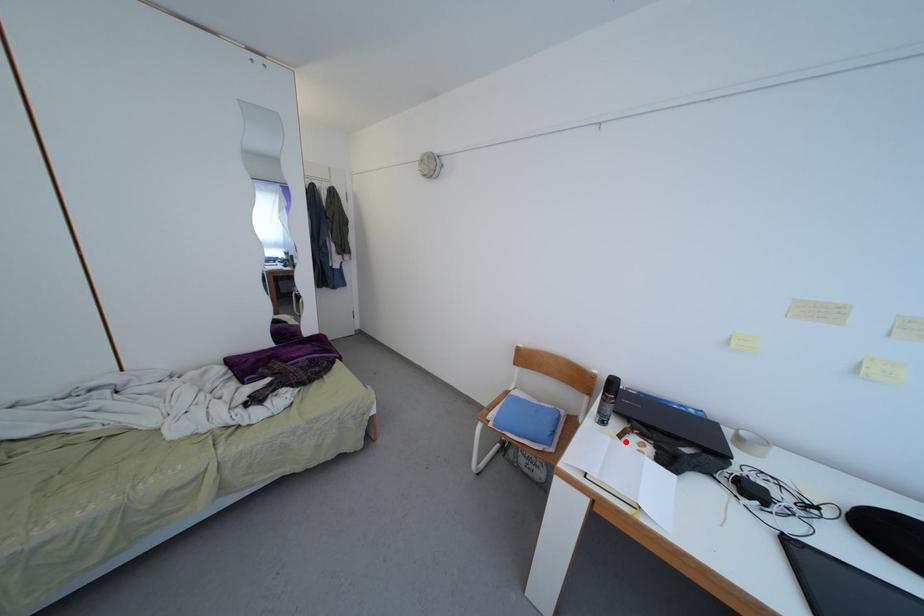
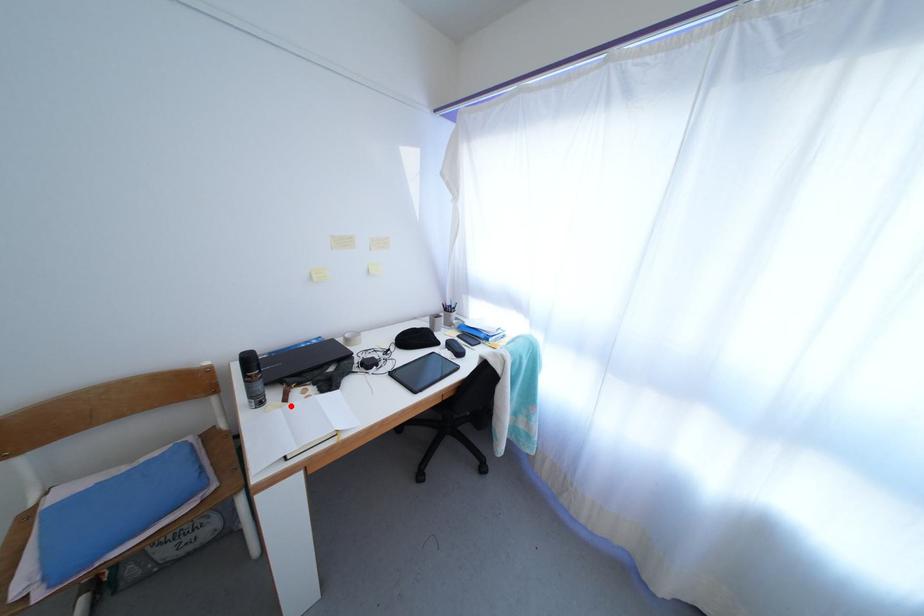
I am providing you with two images of the same scene from different viewpoints. A red point is marked on the first image and another point is marked on the second image. Are the points marked in image1 and image2 representing the same 3D position?

Yes